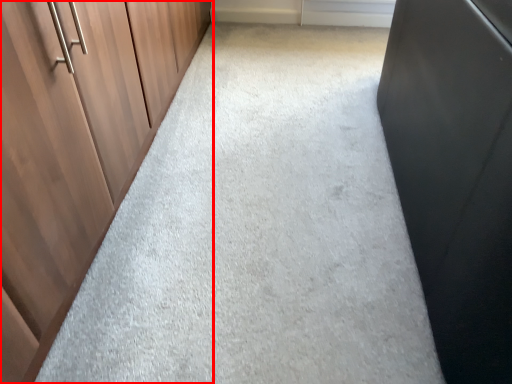
Question: In this image, where is cupboard (annotated by the red box) located relative to window?

Choices:
 (A) left
 (B) right

Answer: (A)